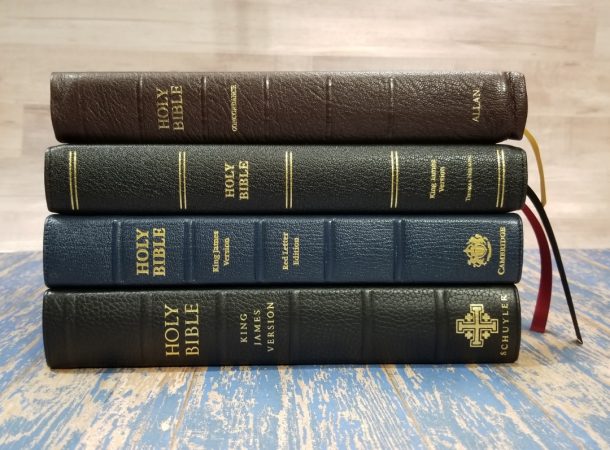
This screenshot has height=450, width=610. In order to click on "holy bible" text in this screenshot , I will do `click(174, 327)`, `click(155, 258)`, `click(232, 179)`, `click(171, 102)`.